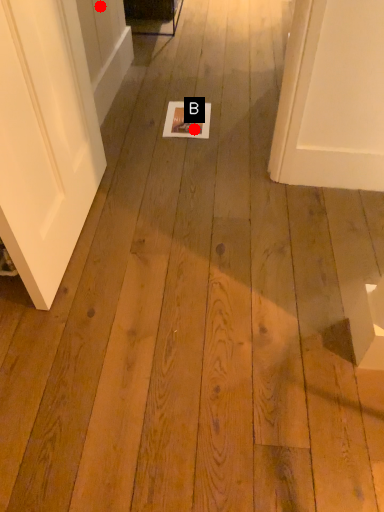
Question: Two points are circled on the image, labeled by A and B beside each circle. Which point appears farthest from the camera in this image?

Choices:
 (A) A is further
 (B) B is further

Answer: (B)